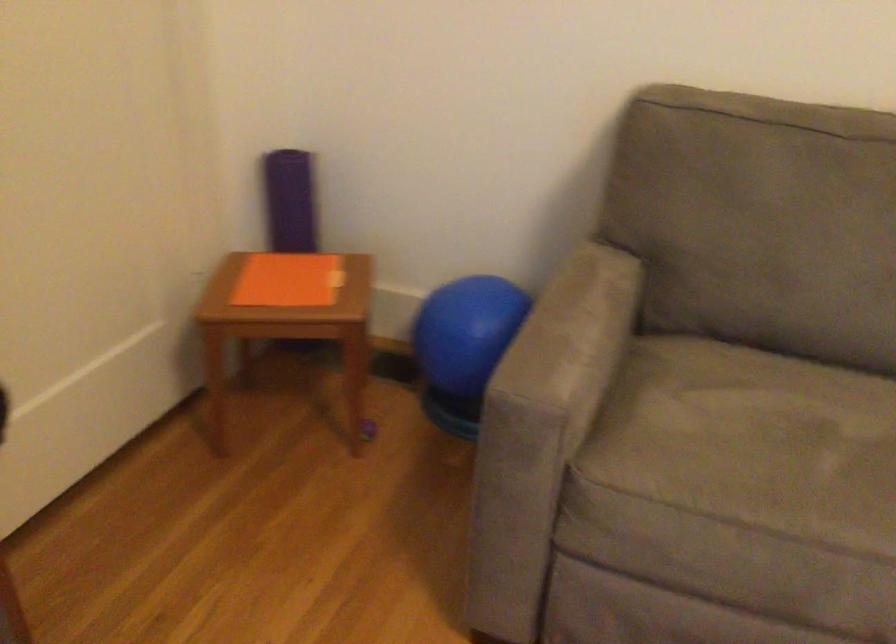
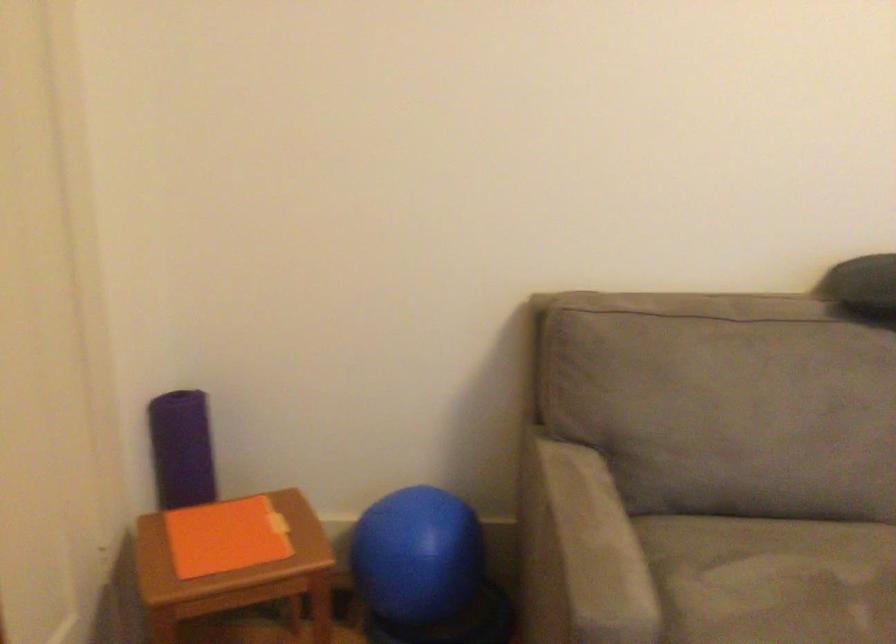
In the second image, find the point that corresponds to point 757,413 in the first image.

(771, 579)